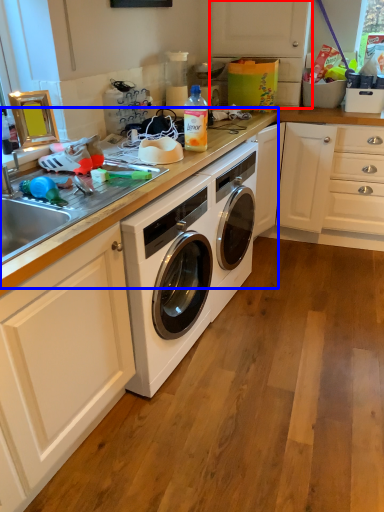
Question: Which object appears farthest to the camera in this image, cabinetry (highlighted by a red box) or counter top (highlighted by a blue box)?

Choices:
 (A) cabinetry
 (B) counter top

Answer: (A)